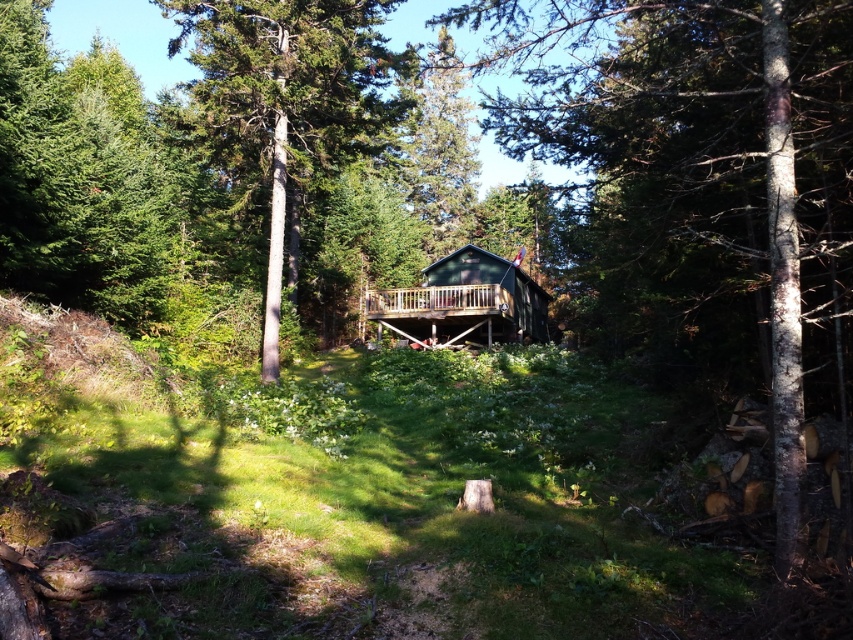
Measure the distance between point (525, 29) and camera.

Point (525, 29) and camera are 58.54 meters apart.

Is green wood cabin at center thinner than smooth gray tree trunk at center?

Indeed, green wood cabin at center has a lesser width compared to smooth gray tree trunk at center.

Who is more distant from viewer, [787,228] or [338,24]?

The point [338,24] is behind.

In order to click on green wood cabin at center in this screenshot , I will do `click(703, 188)`.

Is green wood cabin at center taller than green matte cabin at center?

Yes, green wood cabin at center is taller than green matte cabin at center.

Is point (773, 172) positioned behind point (486, 266)?

No, (773, 172) is in front of (486, 266).

Describe the element at coordinates (703, 188) in the screenshot. The width and height of the screenshot is (853, 640). I see `green wood cabin at center` at that location.

At what (x,y) coordinates should I click in order to perform the action: click on green wood cabin at center. Please return your answer as a coordinate pair (x, y). The height and width of the screenshot is (640, 853). Looking at the image, I should click on (703, 188).

What are the coordinates of `smooth gray tree trunk at center` in the screenshot? It's located at (283, 104).

You are a GUI agent. You are given a task and a screenshot of the screen. Output one action in this format:
    pyautogui.click(x=<x>, y=<y>)
    Task: Click on the smooth gray tree trunk at center
    Image resolution: width=853 pixels, height=640 pixels.
    Given the screenshot: What is the action you would take?
    pyautogui.click(x=283, y=104)